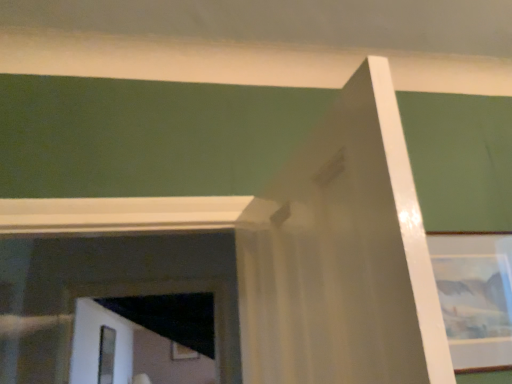
Question: Is matte glass picture frame at upper right, which is counted as the second picture frame, starting from the bottom, next to wooden picture frame at lower center, the first picture frame positioned from the left?

Choices:
 (A) no
 (B) yes

Answer: (A)

Question: Is the depth of matte glass picture frame at upper right, the 2th picture frame viewed from the left, greater than that of wooden picture frame at lower center, the 1th picture frame in the back-to-front sequence?

Choices:
 (A) yes
 (B) no

Answer: (B)

Question: From the image's perspective, is matte glass picture frame at upper right, the 2th picture frame viewed from the left, below wooden picture frame at lower center, which is the 2th picture frame in top-to-bottom order?

Choices:
 (A) yes
 (B) no

Answer: (B)

Question: Can you confirm if matte glass picture frame at upper right, the 1th picture frame viewed from the front, is taller than wooden picture frame at lower center, which is the 2th picture frame in top-to-bottom order?

Choices:
 (A) no
 (B) yes

Answer: (B)

Question: Does matte glass picture frame at upper right, the 2th picture frame viewed from the left, have a smaller size compared to wooden picture frame at lower center, the second picture frame from the front?

Choices:
 (A) yes
 (B) no

Answer: (A)

Question: From a real-world perspective, is clear glass screen door at lower left physically located above or below matte glass picture frame at upper right, which ranks as the first picture frame in top-to-bottom order?

Choices:
 (A) below
 (B) above

Answer: (A)

Question: Is clear glass screen door at lower left taller or shorter than matte glass picture frame at upper right, which ranks as the 2th picture frame in back-to-front order?

Choices:
 (A) tall
 (B) short

Answer: (A)

Question: From the image's perspective, relative to matte glass picture frame at upper right, which ranks as the 2th picture frame in back-to-front order, is clear glass screen door at lower left above or below?

Choices:
 (A) below
 (B) above

Answer: (A)

Question: Which is correct: clear glass screen door at lower left is inside matte glass picture frame at upper right, the 1th picture frame viewed from the front, or outside of it?

Choices:
 (A) inside
 (B) outside

Answer: (B)

Question: From the image's perspective, is wooden picture frame at lower center, which is the first picture frame in bottom-to-top order, located above or below matte glass picture frame at upper right, which ranks as the first picture frame in top-to-bottom order?

Choices:
 (A) above
 (B) below

Answer: (B)

Question: Do you think wooden picture frame at lower center, the 1th picture frame in the back-to-front sequence, is within matte glass picture frame at upper right, which ranks as the 2th picture frame in back-to-front order, or outside of it?

Choices:
 (A) outside
 (B) inside

Answer: (A)

Question: Based on their sizes in the image, would you say wooden picture frame at lower center, the first picture frame positioned from the left, is bigger or smaller than matte glass picture frame at upper right, which is counted as the second picture frame, starting from the bottom?

Choices:
 (A) big
 (B) small

Answer: (A)

Question: Relative to matte glass picture frame at upper right, which appears as the 1th picture frame when viewed from the right, is wooden picture frame at lower center, the first picture frame positioned from the left, in front or behind?

Choices:
 (A) behind
 (B) front

Answer: (A)

Question: From a real-world perspective, is wooden picture frame at lower center, the second picture frame from the front, positioned above or below clear glass screen door at lower left?

Choices:
 (A) below
 (B) above

Answer: (B)

Question: Relative to clear glass screen door at lower left, is wooden picture frame at lower center, the second picture frame from the front, in front or behind?

Choices:
 (A) front
 (B) behind

Answer: (B)